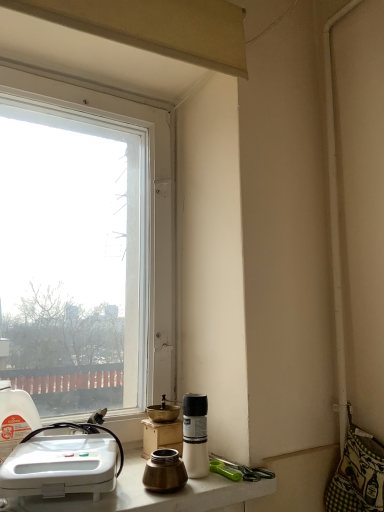
Question: Can you confirm if white matte bottle at lower center, positioned as the second bottle in left-to-right order, is thinner than transparent glass window at upper left?

Choices:
 (A) yes
 (B) no

Answer: (A)

Question: From a real-world perspective, is white matte bottle at lower center, the 1th bottle positioned from the right, located higher than transparent glass window at upper left?

Choices:
 (A) yes
 (B) no

Answer: (B)

Question: Is white matte bottle at lower center, positioned as the second bottle in left-to-right order, at the left side of transparent glass window at upper left?

Choices:
 (A) yes
 (B) no

Answer: (B)

Question: Is white matte bottle at lower center, positioned as the second bottle in left-to-right order, outside of transparent glass window at upper left?

Choices:
 (A) no
 (B) yes

Answer: (B)

Question: From the image's perspective, is white plastic sink at lower left located above or below white glossy countertop at lower center?

Choices:
 (A) below
 (B) above

Answer: (B)

Question: From a real-world perspective, relative to white glossy countertop at lower center, is white plastic sink at lower left vertically above or below?

Choices:
 (A) above
 (B) below

Answer: (A)

Question: Does point (114, 461) appear closer or farther from the camera than point (240, 497)?

Choices:
 (A) closer
 (B) farther

Answer: (A)

Question: In the image, is white plastic sink at lower left positioned in front of or behind white glossy countertop at lower center?

Choices:
 (A) front
 (B) behind

Answer: (B)

Question: In terms of width, does translucent plastic bottle at left, the 2th bottle from the right, look wider or thinner when compared to transparent glass window at upper left?

Choices:
 (A) wide
 (B) thin

Answer: (B)

Question: Is translucent plastic bottle at left, marked as the first bottle in a left-to-right arrangement, in front of or behind transparent glass window at upper left in the image?

Choices:
 (A) front
 (B) behind

Answer: (A)

Question: From the image's perspective, is translucent plastic bottle at left, marked as the first bottle in a left-to-right arrangement, located above or below transparent glass window at upper left?

Choices:
 (A) below
 (B) above

Answer: (A)

Question: In terms of height, does translucent plastic bottle at left, the 2th bottle from the right, look taller or shorter compared to transparent glass window at upper left?

Choices:
 (A) tall
 (B) short

Answer: (B)

Question: Would you say transparent glass window at upper left is inside or outside white matte bottle at lower center, the 1th bottle positioned from the right?

Choices:
 (A) inside
 (B) outside

Answer: (B)

Question: Visually, is transparent glass window at upper left positioned to the left or to the right of white matte bottle at lower center, the 1th bottle positioned from the right?

Choices:
 (A) right
 (B) left

Answer: (B)